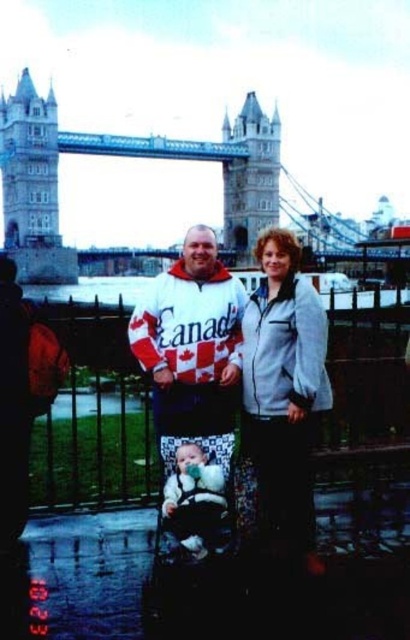
Between light gray zip-up jacket at center and black textured baby carriage at center, which one is positioned higher?

Positioned higher is light gray zip-up jacket at center.

Between light gray zip-up jacket at center and black textured baby carriage at center, which one has more height?

With more height is light gray zip-up jacket at center.

Which is behind, point (280, 476) or point (198, 556)?

Positioned behind is point (280, 476).

Locate an element on the screen. This screenshot has height=640, width=410. light gray zip-up jacket at center is located at coordinates (284, 392).

Does white fleece jacket at center lie in front of black textured baby carriage at center?

That is False.

Describe the element at coordinates (280, 388) in the screenshot. I see `white fleece jacket at center` at that location.

Is point (255, 248) farther from viewer compared to point (193, 536)?

Yes, it is.

What are the coordinates of `white fleece jacket at center` in the screenshot? It's located at (280, 388).

Can you confirm if light gray zip-up jacket at center is positioned to the right of white/red/canadian flag sweater at center?

Yes, light gray zip-up jacket at center is to the right of white/red/canadian flag sweater at center.

Image resolution: width=410 pixels, height=640 pixels. I want to click on light gray zip-up jacket at center, so click(284, 392).

Between point (291, 525) and point (198, 333), which one is positioned in front?

Point (291, 525)

I want to click on light gray zip-up jacket at center, so click(284, 392).